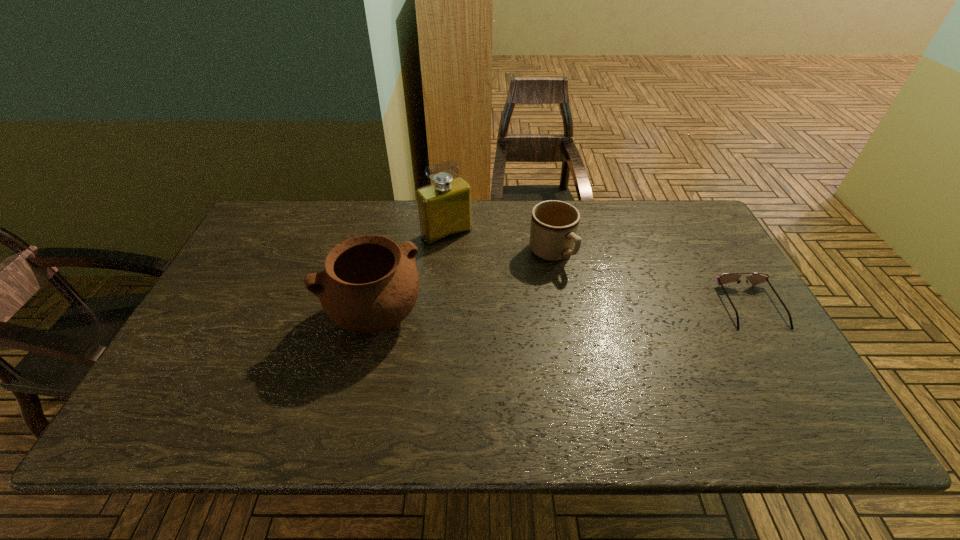
Image resolution: width=960 pixels, height=540 pixels. Identify the location of vacant position located 0.060m on the front-facing side of the tallest object. (468, 256).

Find the location of `free space located 0.240m on the side of the mug with the handle`. free space located 0.240m on the side of the mug with the handle is located at coordinates (622, 325).

You are a GUI agent. You are given a task and a screenshot of the screen. Output one action in this format:
    pyautogui.click(x=<x>, y=<y>)
    Task: Click on the vacant space positioned on the side of the mug with the handle
    Image resolution: width=960 pixels, height=540 pixels.
    Given the screenshot: What is the action you would take?
    pyautogui.click(x=592, y=295)

I want to click on free space located on the side of the mug with the handle, so click(x=583, y=286).

Where is `perfume that is at the far edge`? The width and height of the screenshot is (960, 540). perfume that is at the far edge is located at coordinates (444, 208).

What are the coordinates of `mug that is at the far edge` in the screenshot? It's located at (554, 224).

Image resolution: width=960 pixels, height=540 pixels. What are the coordinates of `object that is at the right edge` in the screenshot? It's located at (755, 278).

Find the location of a particular element. free space at the far edge of the desktop is located at coordinates (504, 217).

Where is `free space at the near edge of the desktop`? free space at the near edge of the desktop is located at coordinates (644, 368).

This screenshot has height=540, width=960. What are the coordinates of `blank space at the left edge of the desktop` in the screenshot? It's located at (211, 350).